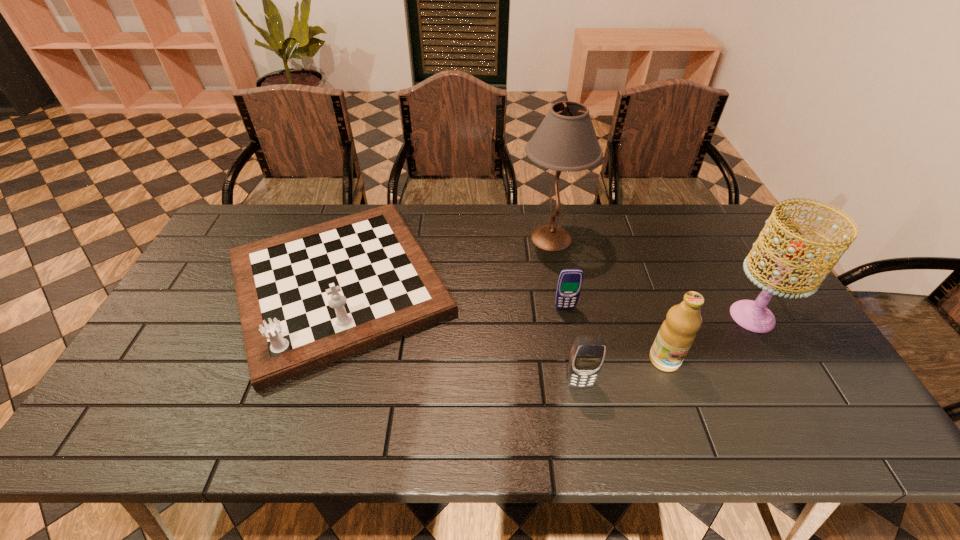
You are a GUI agent. You are given a task and a screenshot of the screen. Output one action in this format:
    pyautogui.click(x=<x>, y=<y>)
    Task: Click on the vacant space that satisfies the following two spatial constraints: 1. on the front-facing side of the tallest object; 2. on the front side of the gameboard
    
    Given the screenshot: What is the action you would take?
    [x=560, y=285]

Find the location of `free space in the image that satisfies the following two spatial constraints: 1. on the front-facing side of the rightmost object; 2. on the right side of the table lamp`. free space in the image that satisfies the following two spatial constraints: 1. on the front-facing side of the rightmost object; 2. on the right side of the table lamp is located at coordinates (565, 316).

What are the coordinates of `free location that satisfies the following two spatial constraints: 1. on the back side of the lampshade; 2. on the front-facing side of the tallest object` in the screenshot? It's located at (708, 238).